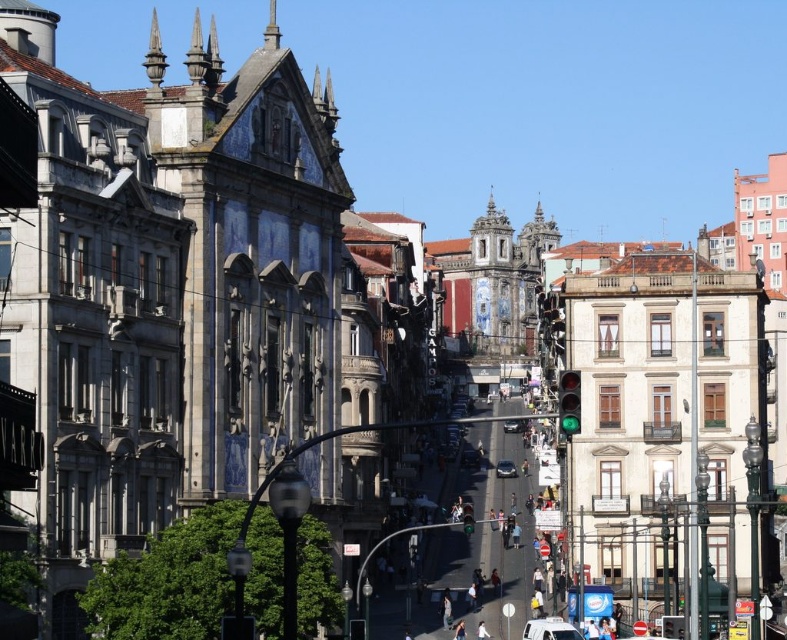
Which is more to the right, white matte car at center or shiny silver sedan at center?

shiny silver sedan at center

Is point (568, 634) closer to viewer compared to point (508, 460)?

Yes, point (568, 634) is closer to viewer.

Is point (536, 621) less distant than point (505, 467)?

Yes, point (536, 621) is closer to viewer.

Locate an element on the screen. This screenshot has height=640, width=787. white matte car at center is located at coordinates (549, 628).

The width and height of the screenshot is (787, 640). What are the coordinates of `white matte car at center` in the screenshot? It's located at (549, 628).

Who is taller, white matte car at center or shiny silver car at center?

With more height is white matte car at center.

This screenshot has width=787, height=640. I want to click on white matte car at center, so click(x=549, y=628).

Where is `white matte car at center`? The width and height of the screenshot is (787, 640). white matte car at center is located at coordinates (549, 628).

Does shiny silver sedan at center have a larger size compared to shiny silver car at center?

Incorrect, shiny silver sedan at center is not larger than shiny silver car at center.

Based on the photo, between shiny silver sedan at center and shiny silver car at center, which one is positioned higher?

shiny silver car at center is above.

Is point (497, 474) farther from viewer compared to point (512, 424)?

No, (497, 474) is closer to viewer.

This screenshot has height=640, width=787. Identify the location of shiny silver sedan at center. (505, 468).